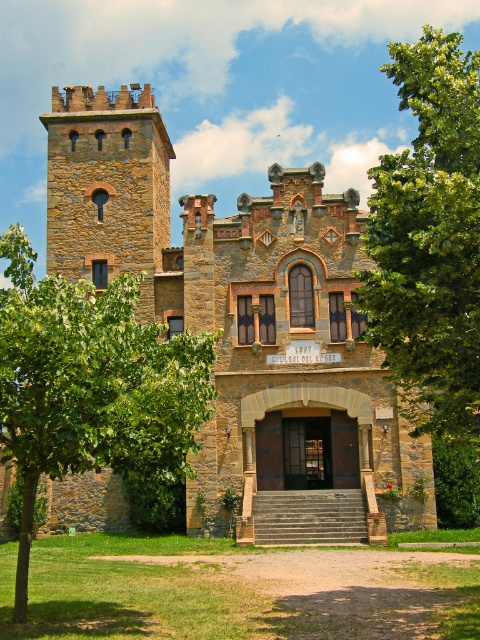
You are an architect planning to add a new structure to the historic stone building. The green leafy tree at upper right and the rustic stone tower at upper left are both in your design plans. Which object has a greater width that you should consider for spacing?

The green leafy tree at upper right has a greater width than the rustic stone tower at upper left, so you should consider its width for spacing.

You are an architect analyzing the proportions of the historic building. Given the presence of the green leafy tree at center and the rustic stone tower at upper left, which object appears larger in the image?

The green leafy tree at center appears larger than the rustic stone tower at upper left according to the description provided.